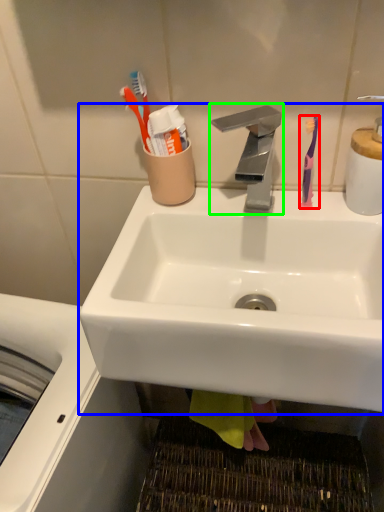
Question: Which object is positioned farthest from toothbrush (highlighted by a red box)? Select from sink (highlighted by a blue box) and tap (highlighted by a green box).

Choices:
 (A) sink
 (B) tap

Answer: (A)